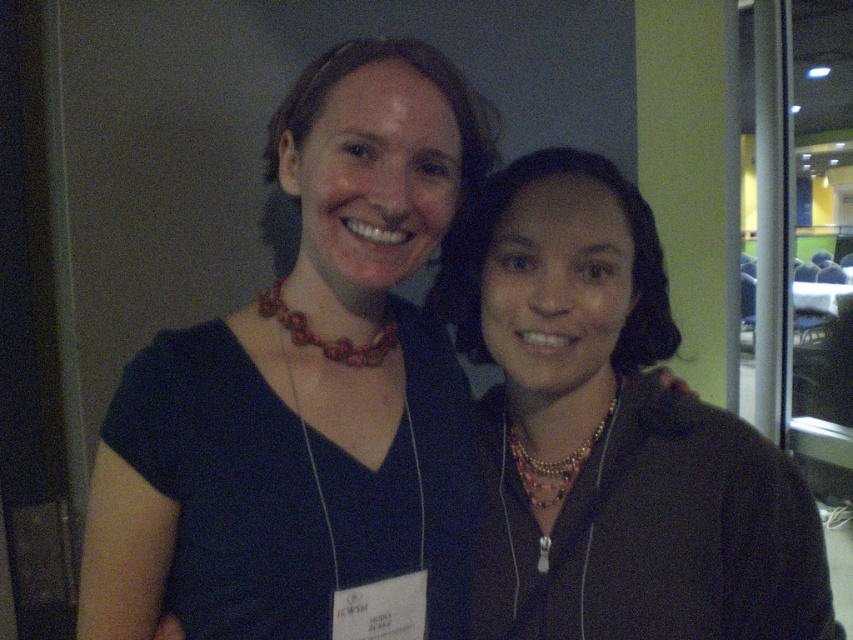
You are standing in a room with two people. You need to place a new name tag at point (611, 433). However, there is already an object there. What is the object at that point?

The object at point (611, 433) is a multicolored beaded necklace at center.